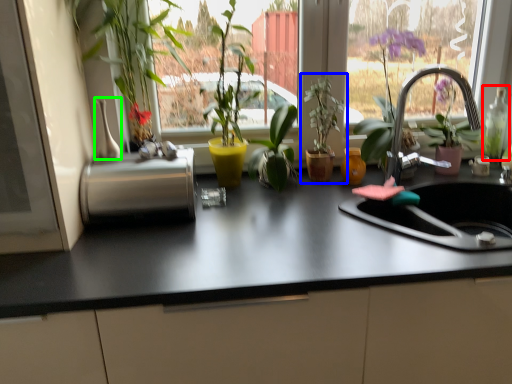
Question: Which is farther away from bottle (highlighted by a red box)? houseplant (highlighted by a blue box) or vase (highlighted by a green box)?

Choices:
 (A) houseplant
 (B) vase

Answer: (B)